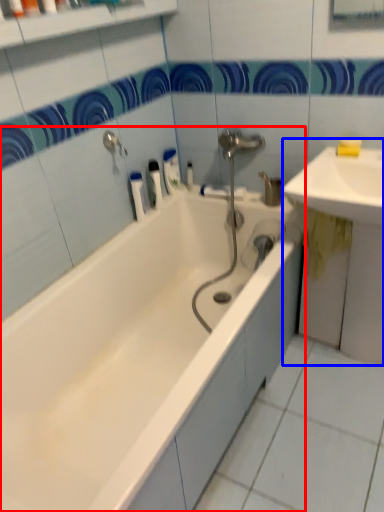
Question: Among these objects, which one is nearest to the camera, bathtub (highlighted by a red box) or sink (highlighted by a blue box)?

Choices:
 (A) bathtub
 (B) sink

Answer: (A)